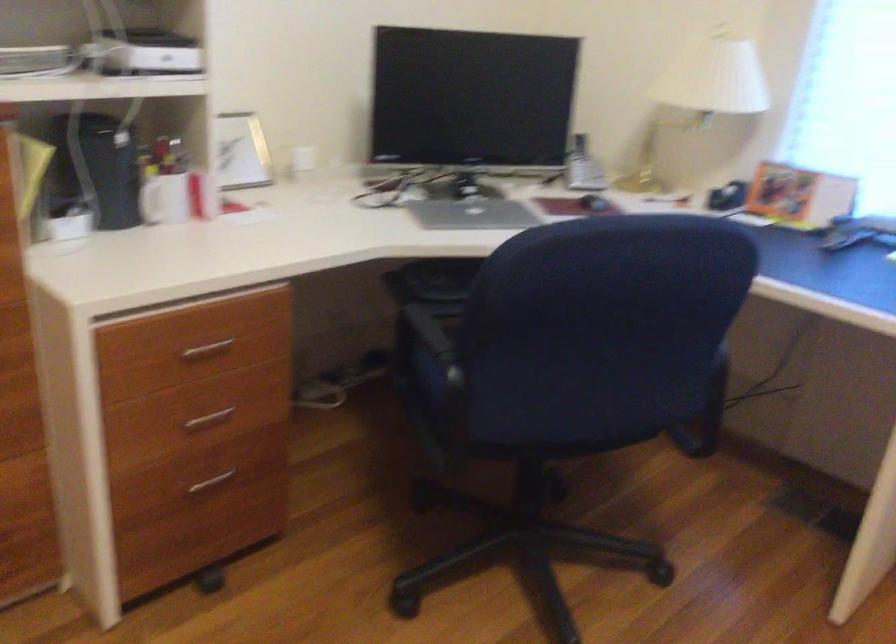
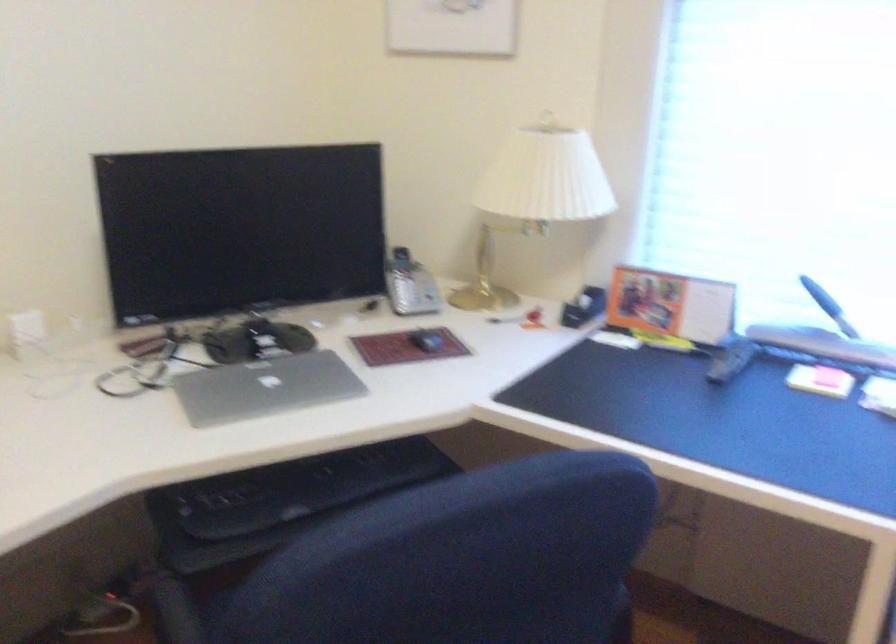
Where in the second image is the point corresponding to (593,201) from the first image?

(426, 341)